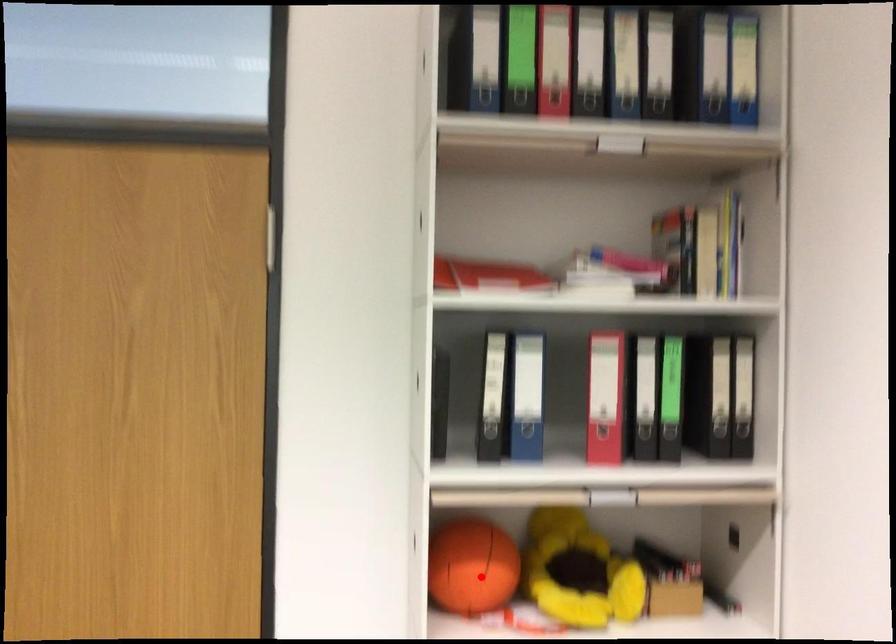
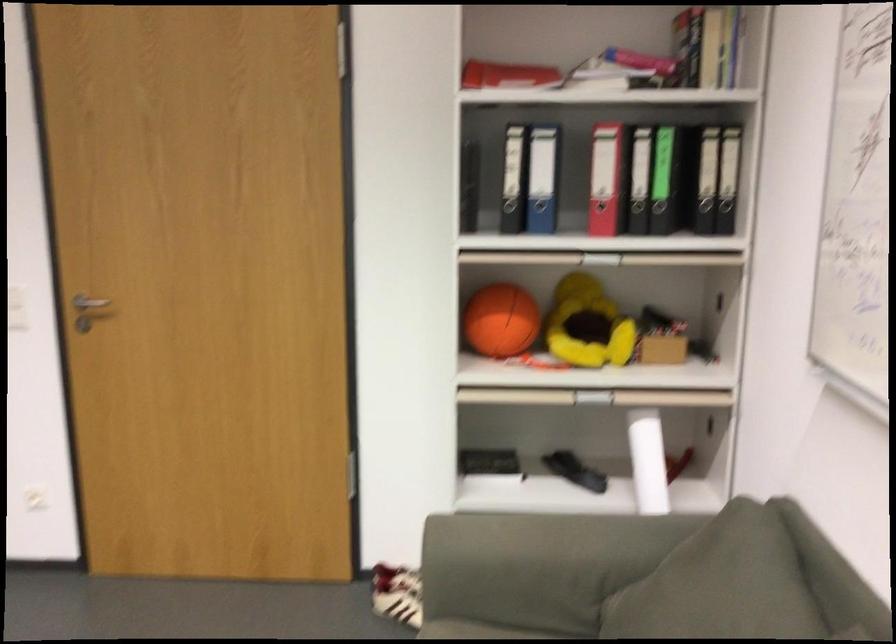
Question: I am providing you with two images of the same scene from different viewpoints. A red point is shown in image1. For the corresponding object point in image2, is it positioned nearer or farther from the camera?

Choices:
 (A) Nearer
 (B) Farther

Answer: (B)